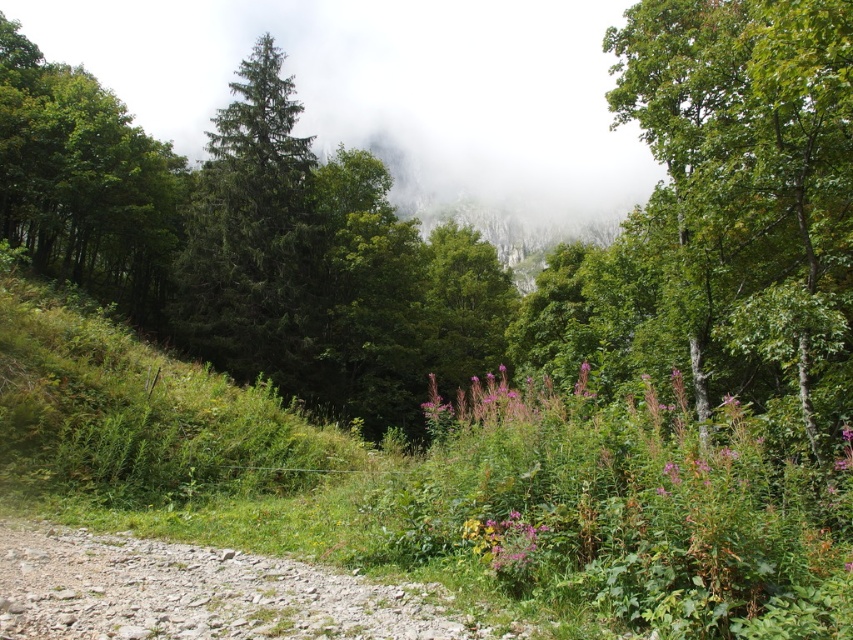
Question: Which of the following is the closest to the observer?

Choices:
 (A) (531, 394)
 (B) (283, 385)
 (C) (508, 548)
 (D) (68, 259)

Answer: (C)

Question: Can you confirm if green matte evergreen tree at center is bigger than purple matte flower at center?

Choices:
 (A) no
 (B) yes

Answer: (B)

Question: From the image, what is the correct spatial relationship of dusty gravel path at lower left in relation to purple soft flower at center?

Choices:
 (A) left
 (B) right

Answer: (A)

Question: Which point is closer to the camera taking this photo?

Choices:
 (A) (500, 545)
 (B) (235, 362)
 (C) (340, 618)
 (D) (506, 381)

Answer: (C)

Question: Does dusty gravel path at lower left appear over green matte tree at left?

Choices:
 (A) no
 (B) yes

Answer: (A)

Question: Estimate the real-world distances between objects in this image. Which object is farther from the purple soft flower at center?

Choices:
 (A) dusty gravel path at lower left
 (B) purple matte flower at center

Answer: (A)